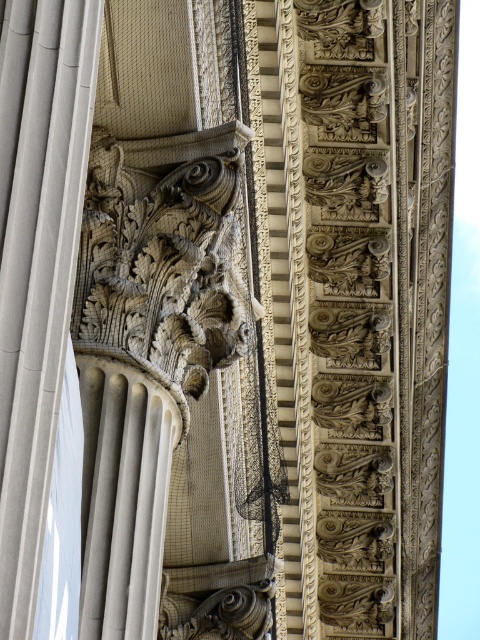
You are an architect designing a replica of this classical column and entablature. The point at coordinate point (87, 44) is part of the column. If the distance between this point and the edge of the entablature is 124.75 feet, will a 120 feet long measuring tape be sufficient to measure this distance?

The distance between the point at coordinate point (87, 44) and the edge of the entablature is 124.75 feet. Since the measuring tape is only 120 feet long, it is not long enough to measure the entire distance.

Looking at the classical architectural detail, there are two columns at the center. The carved stone column at center and the smooth stone column at center. Which one has a larger size?

The carved stone column at center is bigger than the smooth stone column at center, so the carved stone column at center is larger in size.